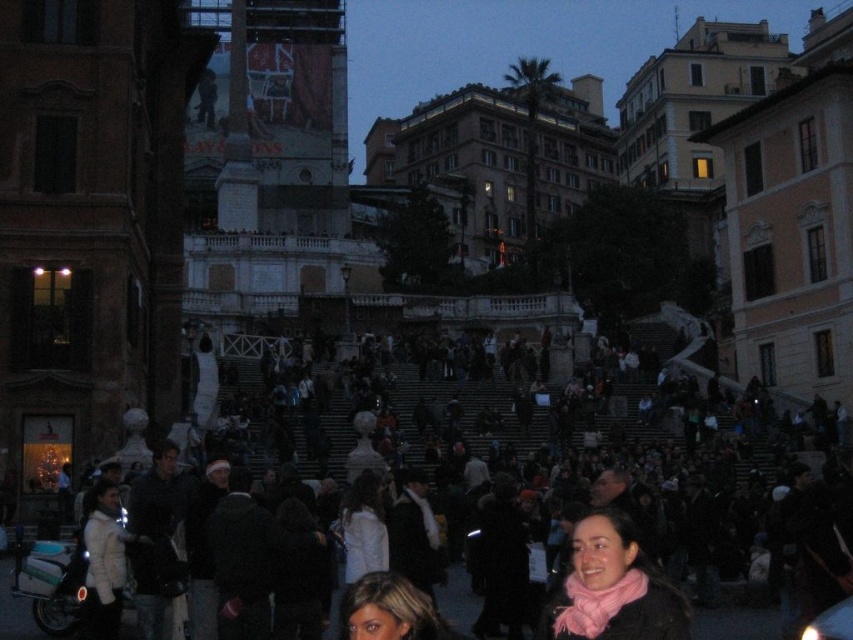
You are a photographer standing at the bottom of the Spanish Steps. You want to capture a photo of the pink scarf at lower center without including the dark clothing crowd at center in the frame. Is this possible given their sizes?

The dark clothing crowd at center is wider than the pink scarf at lower center, so it might be challenging to exclude the crowd from the photo. Adjust your angle or position to focus solely on the pink scarf at lower center.

You are a photographer standing at the Spanish Steps in Rome during the evening. You notice a pink scarf at lower center and a person with blonde hair at center. Which object is positioned higher from the ground? Please answer based on their positions in the image.

The pink scarf at lower center is located above blonde hair at center, so the pink scarf at lower center is positioned higher from the ground.